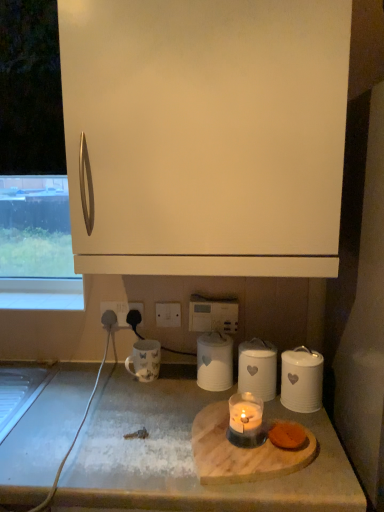
Image resolution: width=384 pixels, height=512 pixels. In order to click on free spot in front of white glossy mug at lower left in this screenshot , I will do `click(137, 407)`.